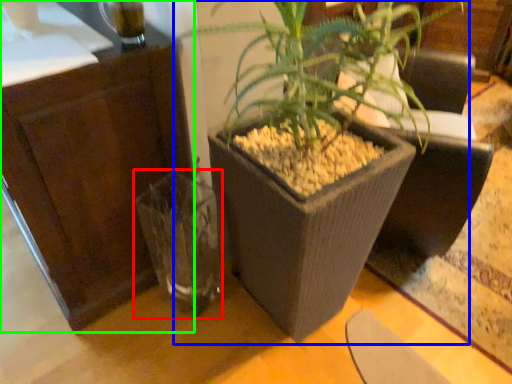
Question: Considering the real-world distances, which object is closest to vase (highlighted by a red box)? houseplant (highlighted by a blue box) or dresser (highlighted by a green box).

Choices:
 (A) houseplant
 (B) dresser

Answer: (B)